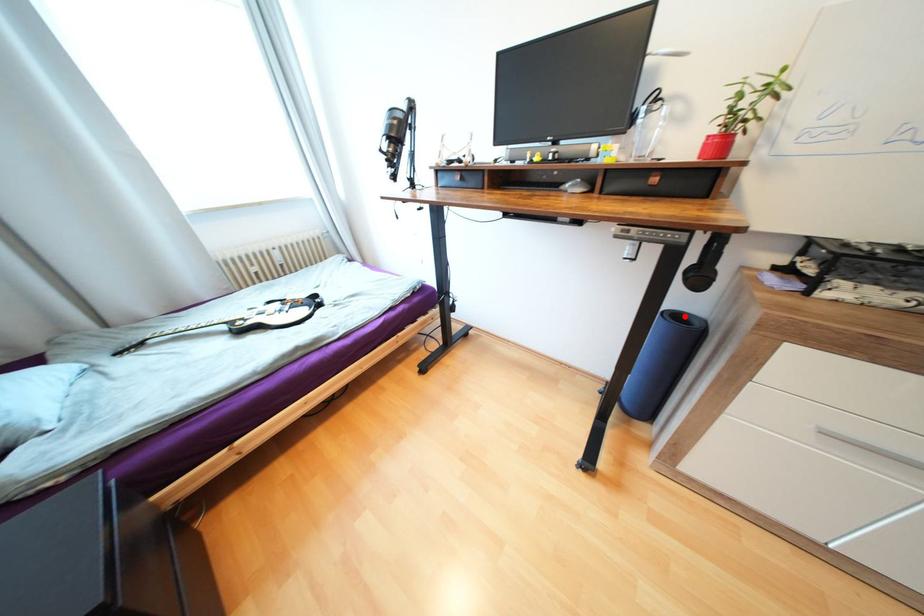
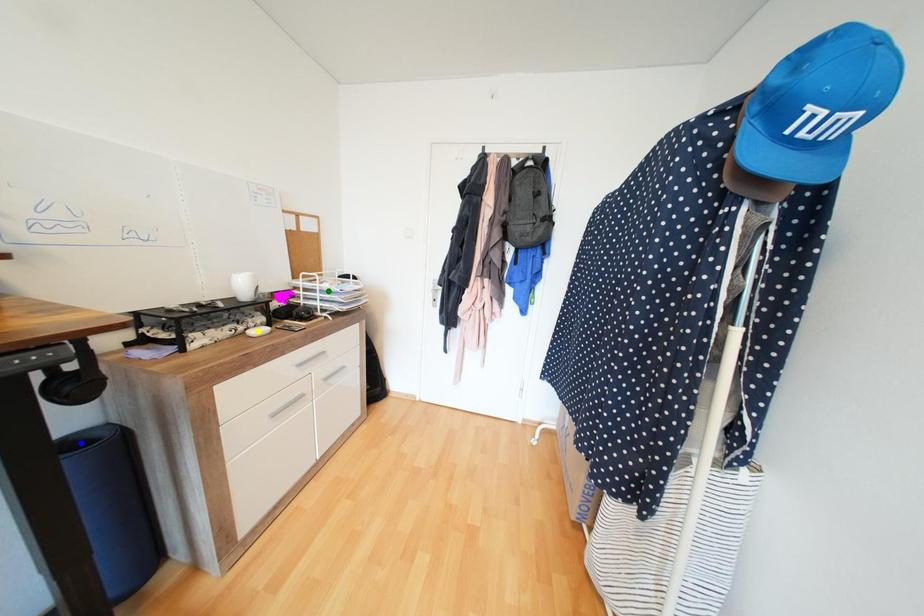
Question: I am providing you with two images of the same scene from different viewpoints. A red point is marked on the first image. You are given multiple points on the second image. Which point in image 2 is actually the same real-world point as the red point in image 1?

Choices:
 (A) yellow point
 (B) blue point
 (C) green point

Answer: (B)